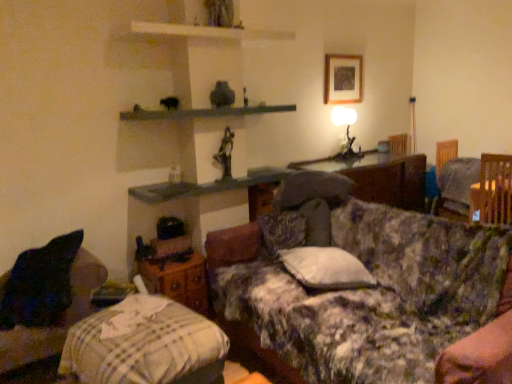
Find the location of a particular element. blank space to the left of metallic statue at upper center is located at coordinates (206, 178).